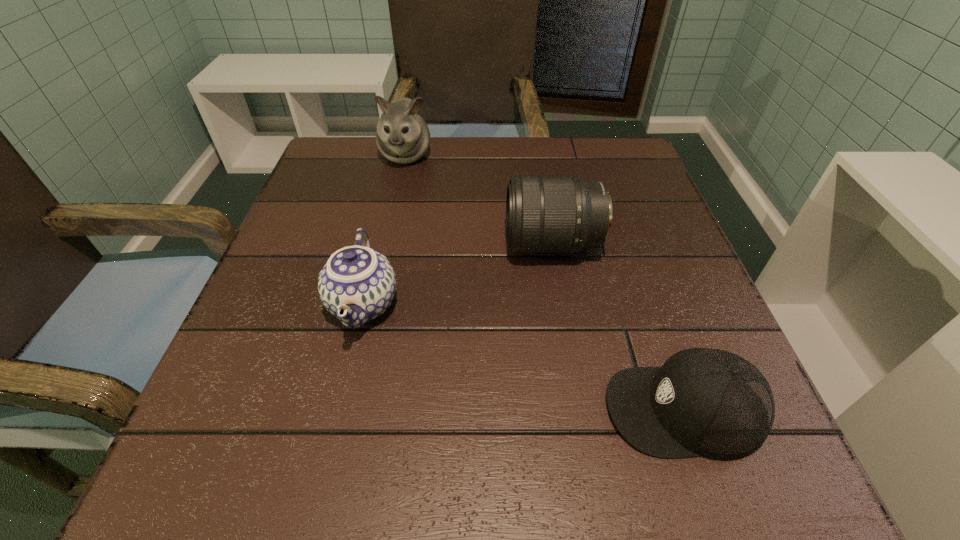
Where is `unoccupied position between the telephoto lens and the nearest object`? unoccupied position between the telephoto lens and the nearest object is located at coordinates (618, 327).

I want to click on free point between the hamster and the chinaware, so click(385, 230).

You are a GUI agent. You are given a task and a screenshot of the screen. Output one action in this format:
    pyautogui.click(x=<x>, y=<y>)
    Task: Click on the free space between the farthest object and the nearest object
    This screenshot has width=960, height=540.
    Given the screenshot: What is the action you would take?
    click(x=544, y=282)

Where is `vacant space in between the hamster and the telephoto lens`? Image resolution: width=960 pixels, height=540 pixels. vacant space in between the hamster and the telephoto lens is located at coordinates (479, 200).

Image resolution: width=960 pixels, height=540 pixels. I want to click on vacant space that is in between the telephoto lens and the shortest object, so click(x=618, y=327).

Where is `free spot between the shortest object and the farthest object`? This screenshot has height=540, width=960. free spot between the shortest object and the farthest object is located at coordinates (544, 282).

Image resolution: width=960 pixels, height=540 pixels. I want to click on object that is the second closest to the chinaware, so (402, 136).

Find the location of a particular element. This screenshot has height=540, width=960. object that can be found as the closest to the farthest object is located at coordinates (544, 214).

Find the location of a particular element. The width and height of the screenshot is (960, 540). vacant space that satisfies the following two spatial constraints: 1. on the surface of the telephoto lens; 2. from the spout of the second shortest object is located at coordinates (x=563, y=303).